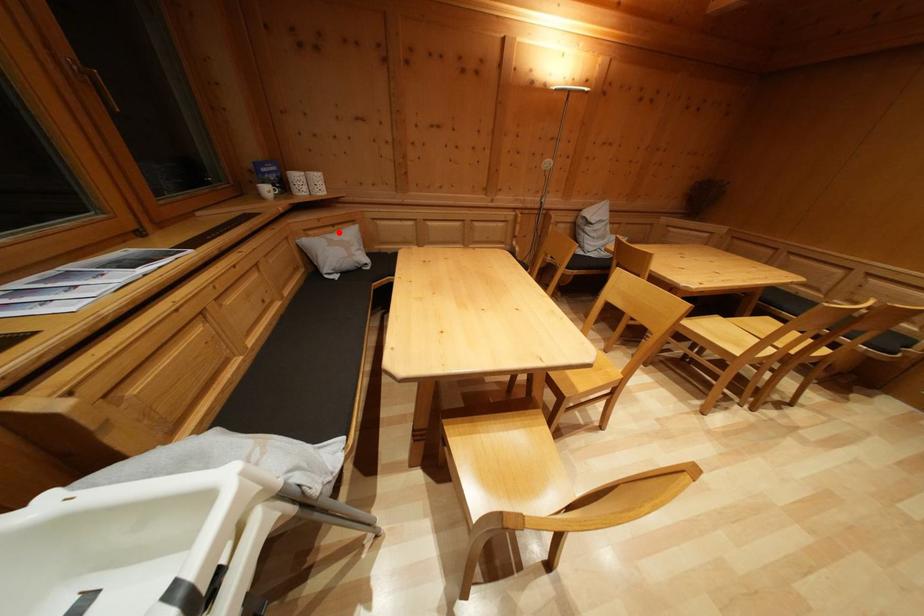
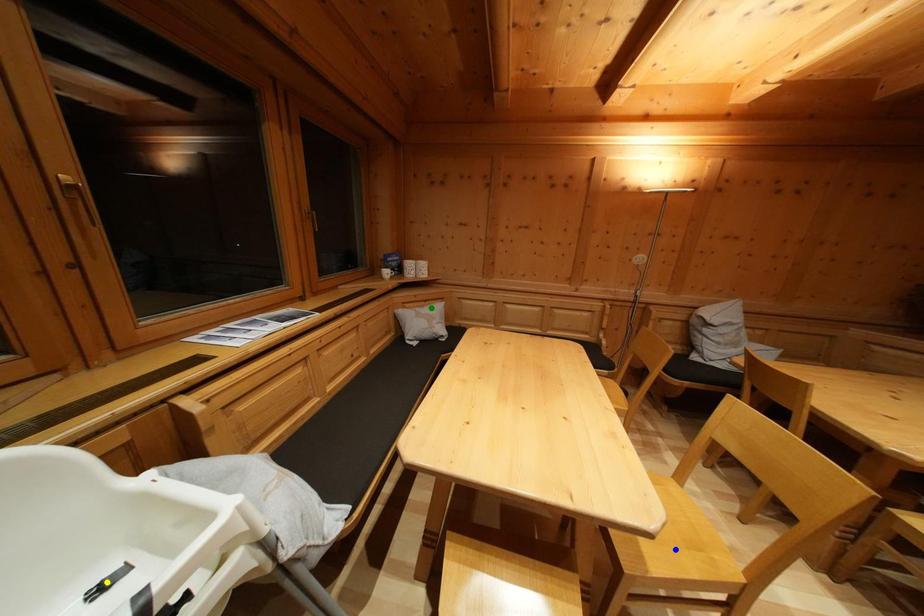
Question: I am providing you with two images of the same scene from different viewpoints. A red point is marked on the first image. You are given multiple points on the second image. Which spot in image 2 lines up with the point in image 1?

Choices:
 (A) yellow point
 (B) blue point
 (C) green point

Answer: (C)